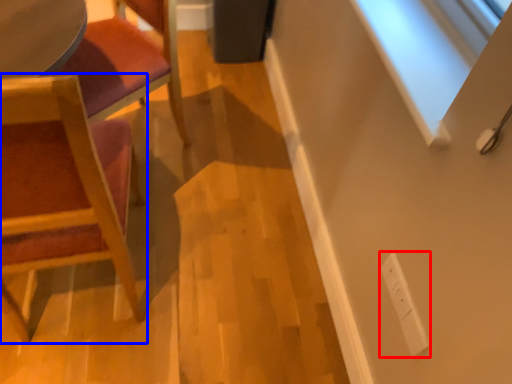
Question: Which object appears farthest to the camera in this image, electric outlet (highlighted by a red box) or chair (highlighted by a blue box)?

Choices:
 (A) electric outlet
 (B) chair

Answer: (A)